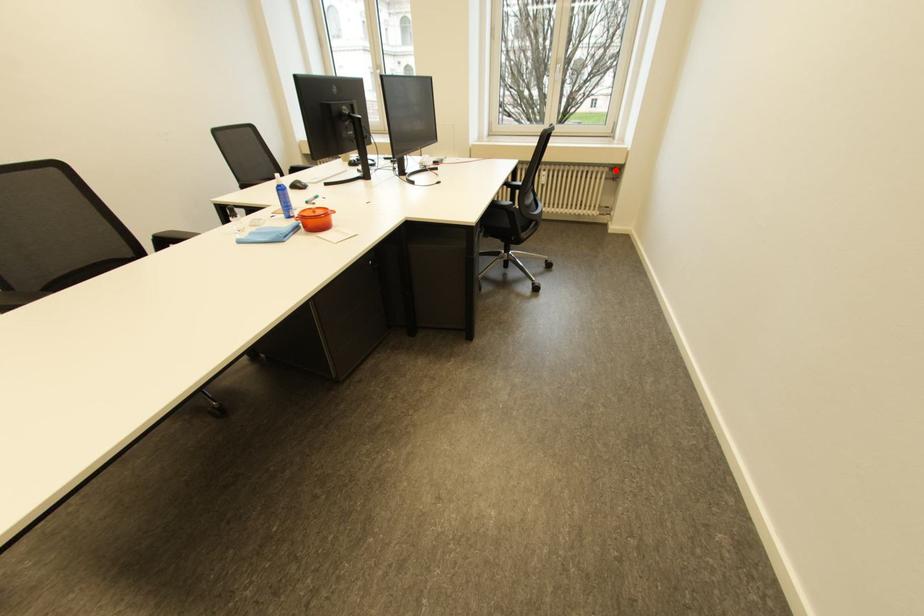
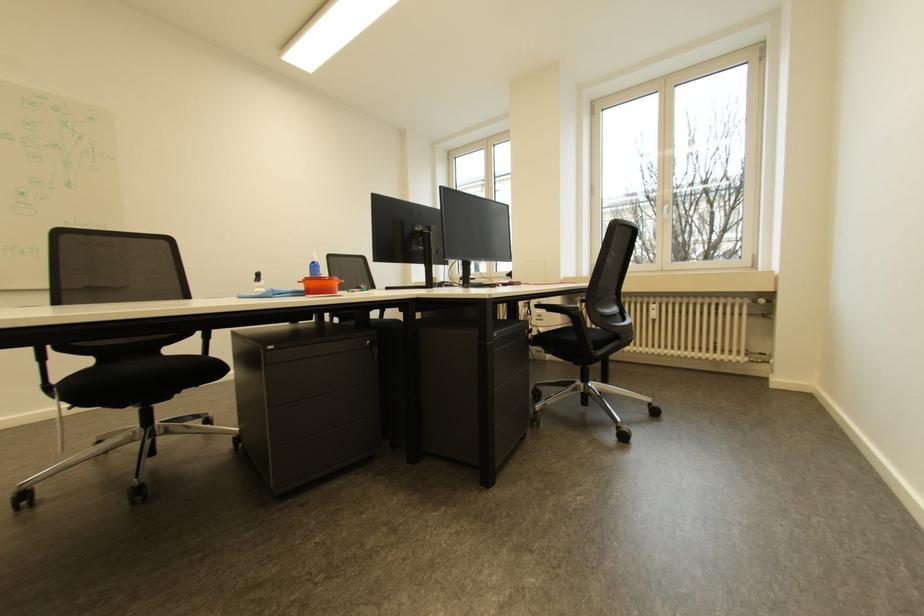
Find the pixel in the second image that matches the highlighted location in the first image.

(757, 302)